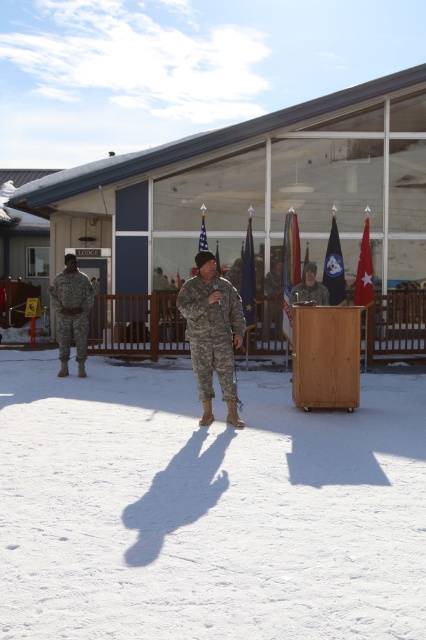
You are a photographer trying to capture the American flag in the background. You notice a point at coordinates (71, 310) in your camera viewfinder. What object is this point located on?

The point at coordinates (71, 310) is located on the camouflage fabric uniform at left.

You are a photographer positioned in the middle of the scene. You want to take a photo that includes both the point at coordinates point (86, 314) and point (284, 244). Since you know one of them is closer to you, which point should you focus on first to ensure both are in focus?

You should focus on point (86, 314) first because it is closer to you than point (284, 244). By focusing on the closer point, the farther point will also be in focus due to the depth of field.

You are a photographer at the event and need to capture both the camouflage fabric uniform at left and the matte khaki uniform at center in a single frame. Given the camera has a fixed focal length, which uniform should you position closer to the camera to ensure both appear equally sized in the photo?

To make both uniforms appear equally sized in the photo, position the matte khaki uniform at center closer to the camera since the camouflage fabric uniform at left is already larger in size.